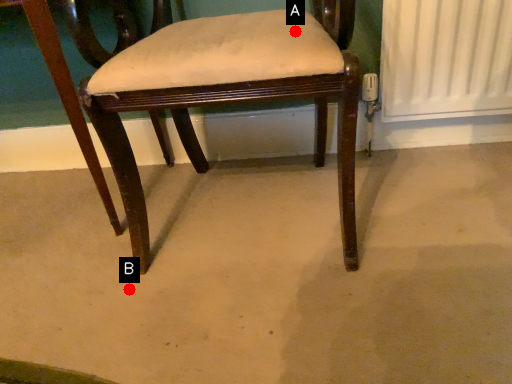
Question: Two points are circled on the image, labeled by A and B beside each circle. Among these points, which one is farthest from the camera?

Choices:
 (A) A is further
 (B) B is further

Answer: (B)